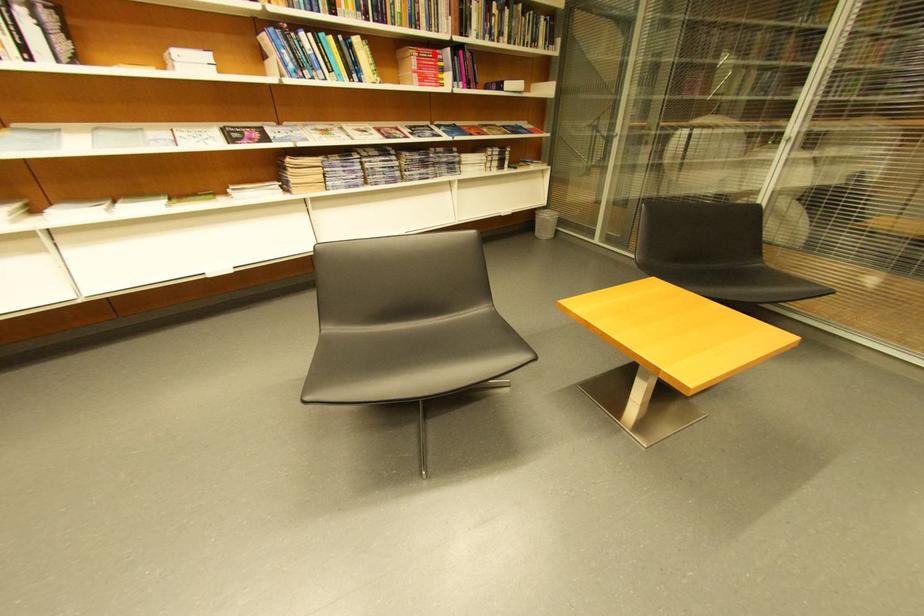
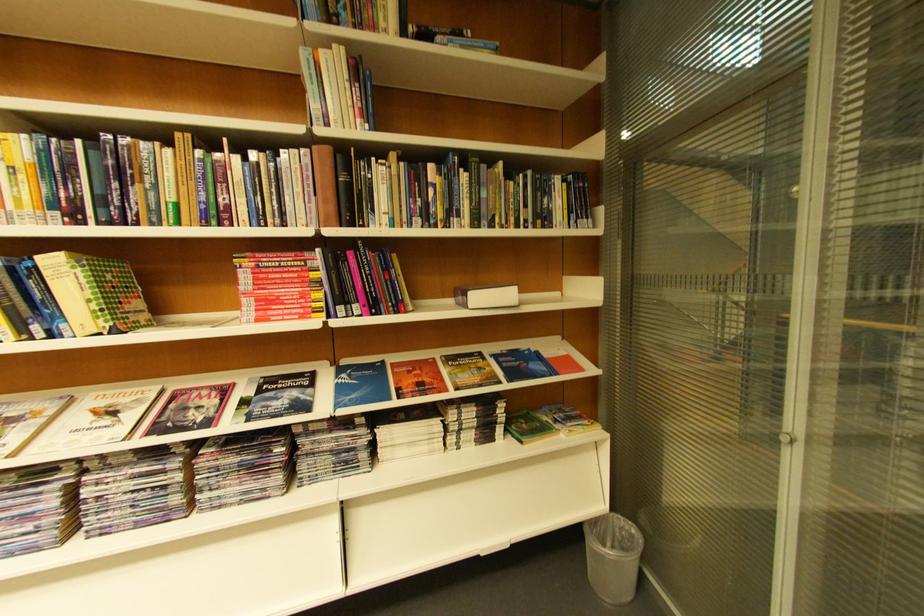
Find the pixel in the second image that matches the highlighted location in the first image.

(281, 262)